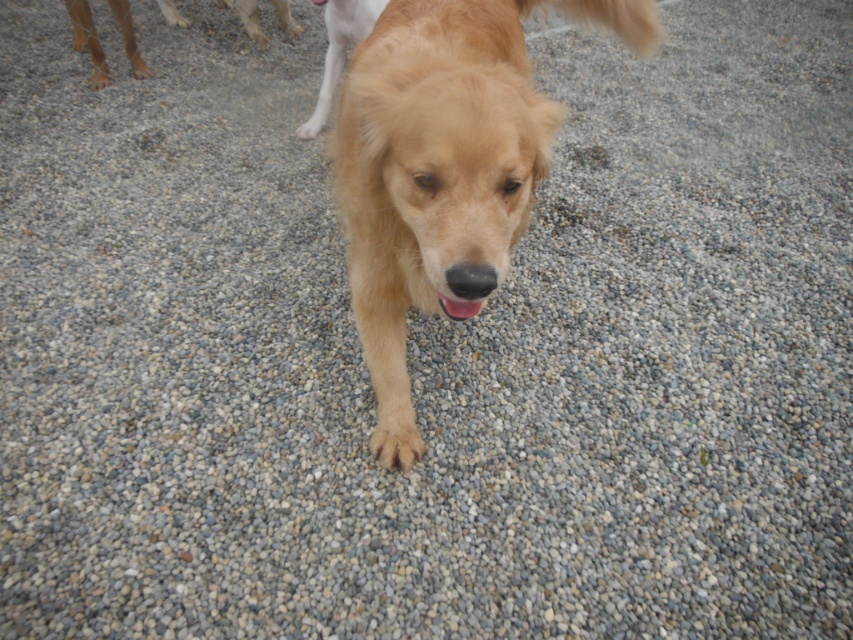
Does golden fur dog at center appear over golden fur dog at upper left?

No.

Does point (502, 196) come behind point (248, 26)?

No, (502, 196) is in front of (248, 26).

Who is more forward, (370,35) or (146,70)?

Positioned in front is point (370,35).

The width and height of the screenshot is (853, 640). What are the coordinates of `golden fur dog at center` in the screenshot? It's located at (444, 170).